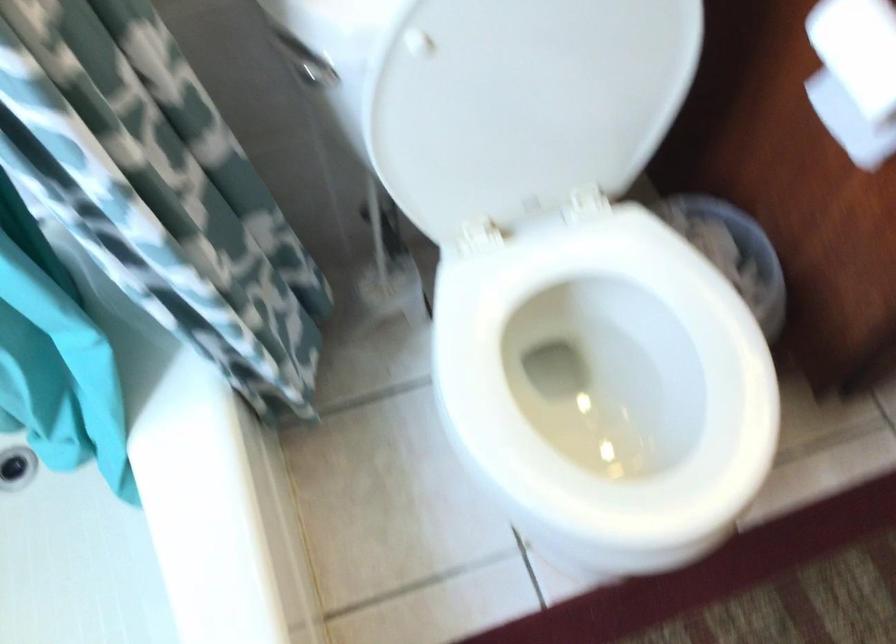
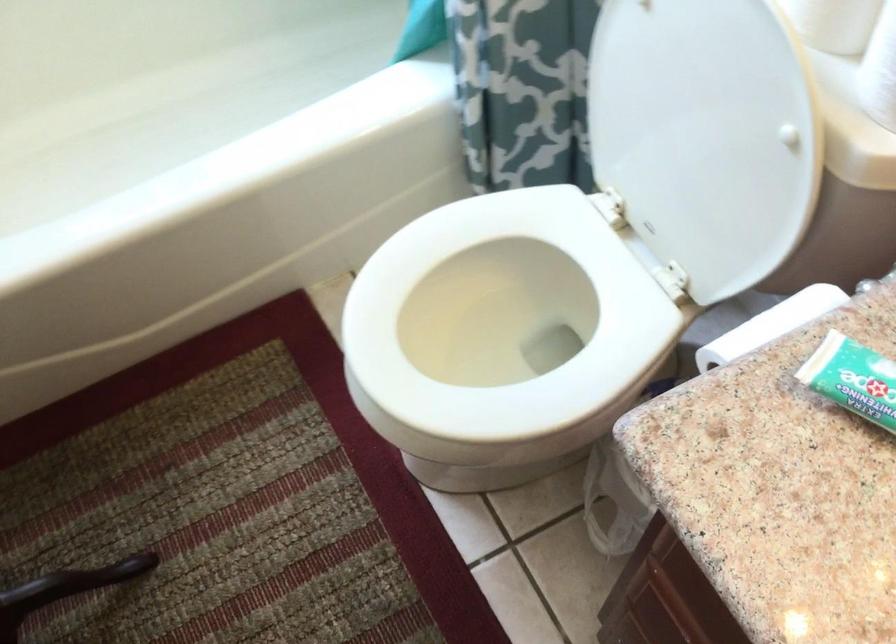
In the second image, find the point that corresponds to the point at 535,408 in the first image.

(504, 334)